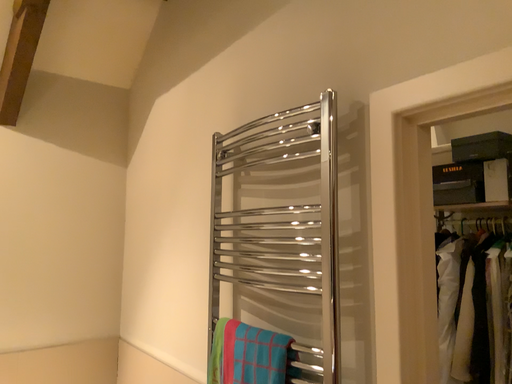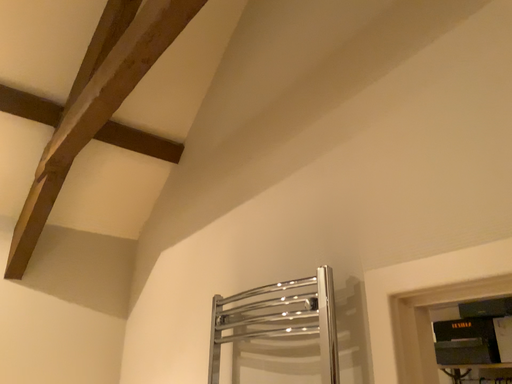
Question: How did the camera likely rotate when shooting the video?

Choices:
 (A) rotated downward
 (B) rotated upward

Answer: (B)